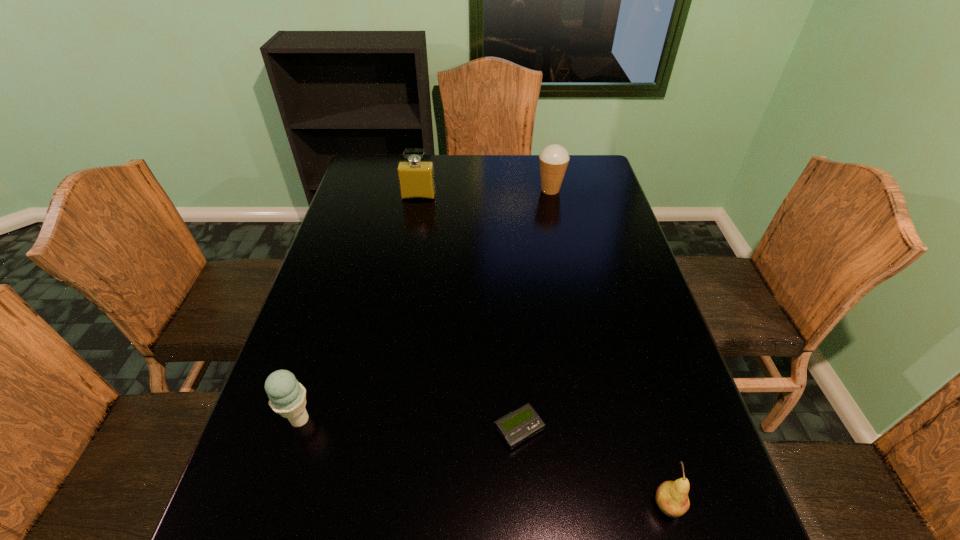
The height and width of the screenshot is (540, 960). I want to click on vacant region located on the left of the farther ice cream, so click(504, 190).

Find the location of a particular element. The width and height of the screenshot is (960, 540). vacant space situated on the back of the left ice cream is located at coordinates (337, 302).

Identify the location of vacant point located 0.290m on the left of the rightmost object. (492, 505).

Where is `vacant space positioned on the back of the third object from right to left`? This screenshot has height=540, width=960. vacant space positioned on the back of the third object from right to left is located at coordinates (514, 354).

This screenshot has width=960, height=540. I want to click on object positioned at the far edge, so click(554, 159).

The width and height of the screenshot is (960, 540). What are the coordinates of `object present at the left edge` in the screenshot? It's located at (287, 397).

Identify the location of icecream that is at the right edge. The height and width of the screenshot is (540, 960). (554, 159).

The image size is (960, 540). I want to click on pear present at the right edge, so click(x=671, y=497).

Identify the location of object at the far right corner. The width and height of the screenshot is (960, 540). (554, 159).

Find the location of a particular element. This screenshot has height=540, width=960. free region at the far edge of the desktop is located at coordinates (480, 162).